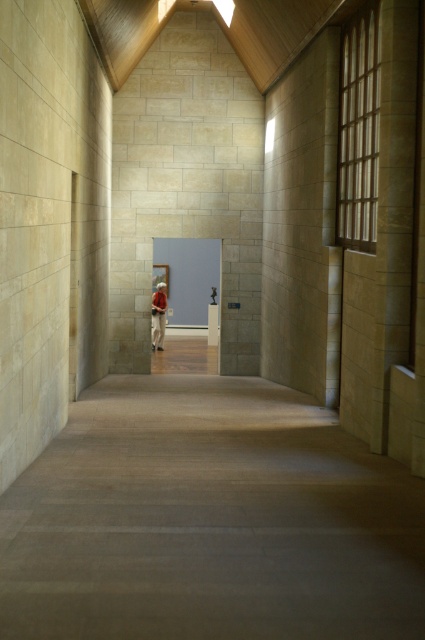
You are standing in the hallway of a modern museum. You see a point marked at coordinates (x=189, y=276). What object is located at that point?

The point at coordinates (x=189, y=276) corresponds to the matte gray door at center.

You are standing in the middle of the hallway and want to pass through the door. Considering the space, can the red fabric person at center fit through the matte gray door at center?

The matte gray door at center is wider than the red fabric person at center, so yes, the red fabric person at center can fit through the matte gray door at center.